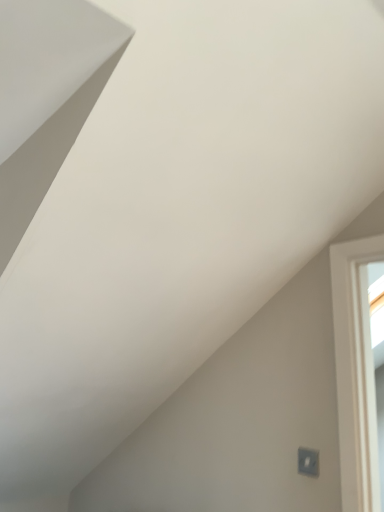
What do you see at coordinates (308, 462) in the screenshot? I see `gray matte electric outlet at lower right` at bounding box center [308, 462].

Where is `gray matte electric outlet at lower right`? This screenshot has height=512, width=384. gray matte electric outlet at lower right is located at coordinates (308, 462).

Find the location of a particular element. This screenshot has height=512, width=384. gray matte electric outlet at lower right is located at coordinates (308, 462).